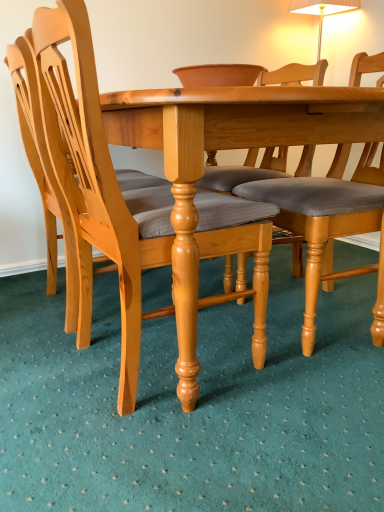
Locate an element on the screen. vacant location below light brown wood chair at center, the 1th chair viewed from the right (from a real-world perspective) is located at coordinates (319, 320).